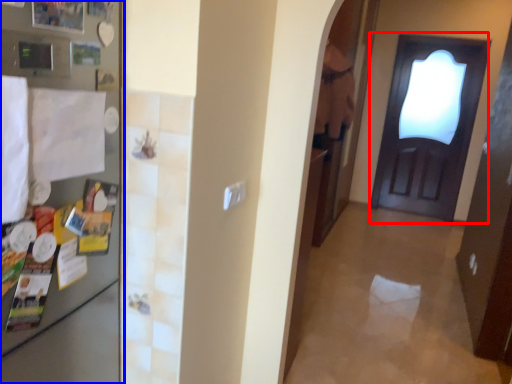
Question: Among these objects, which one is nearest to the camera, door (highlighted by a red box) or fridge (highlighted by a blue box)?

Choices:
 (A) door
 (B) fridge

Answer: (B)